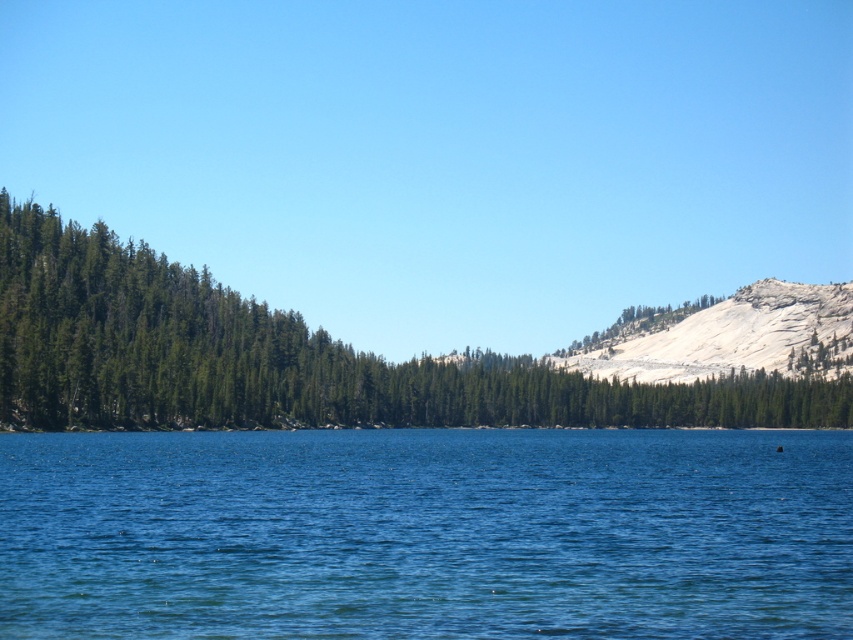
Based on the photo, does blue liquid water at center have a lesser height compared to gray/granite mountain at right?

Correct, blue liquid water at center is not as tall as gray/granite mountain at right.

Is blue liquid water at center thinner than gray/granite mountain at right?

In fact, blue liquid water at center might be wider than gray/granite mountain at right.

Describe the element at coordinates (426, 532) in the screenshot. This screenshot has height=640, width=853. I see `blue liquid water at center` at that location.

Locate an element on the screen. Image resolution: width=853 pixels, height=640 pixels. blue liquid water at center is located at coordinates (426, 532).

Can you confirm if blue liquid water at center is positioned below green matte trees at left?

Indeed, blue liquid water at center is positioned under green matte trees at left.

Find the location of a particular element. The width and height of the screenshot is (853, 640). blue liquid water at center is located at coordinates (426, 532).

The height and width of the screenshot is (640, 853). I want to click on blue liquid water at center, so click(x=426, y=532).

Does point (194, 378) come closer to viewer compared to point (759, 285)?

Yes, point (194, 378) is in front of point (759, 285).

Can you confirm if green matte trees at left is positioned above gray/granite mountain at right?

Incorrect, green matte trees at left is not positioned above gray/granite mountain at right.

Identify the location of green matte trees at left. (289, 358).